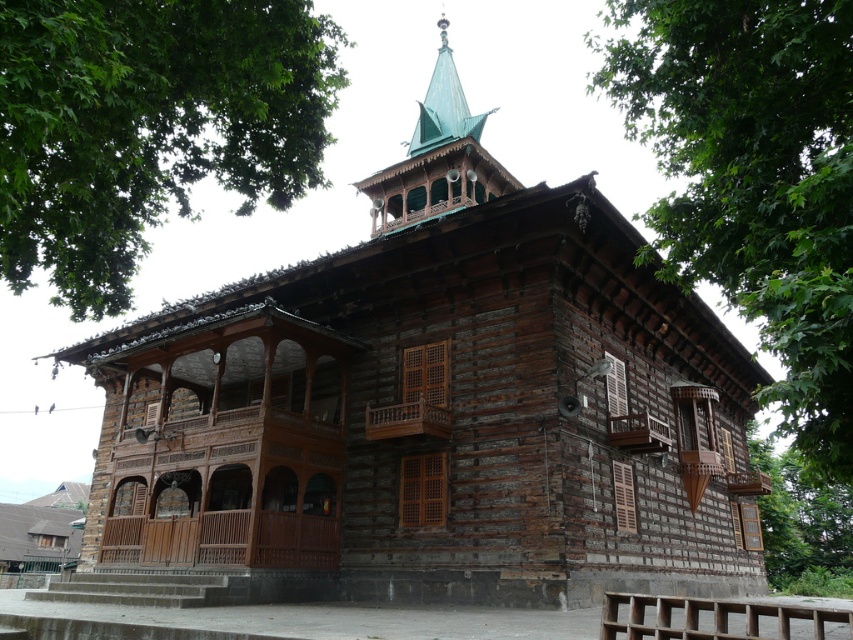
Does green leafy tree at upper left have a smaller size compared to green copper spire at upper center?

Actually, green leafy tree at upper left might be larger than green copper spire at upper center.

Does green leafy tree at upper left appear on the left side of green copper spire at upper center?

Yes, green leafy tree at upper left is to the left of green copper spire at upper center.

The height and width of the screenshot is (640, 853). In order to click on green leafy tree at upper left in this screenshot , I will do `click(148, 125)`.

Image resolution: width=853 pixels, height=640 pixels. What are the coordinates of `green leafy tree at upper left` in the screenshot? It's located at (148, 125).

From the picture: Is green leafy tree at upper left to the right of green leafy tree at upper right from the viewer's perspective?

No, green leafy tree at upper left is not to the right of green leafy tree at upper right.

Is green leafy tree at upper left behind green leafy tree at upper right?

That is False.

This screenshot has height=640, width=853. I want to click on green leafy tree at upper left, so click(x=148, y=125).

At what (x,y) coordinates should I click in order to perform the action: click on green leafy tree at upper left. Please return your answer as a coordinate pair (x, y). The height and width of the screenshot is (640, 853). Looking at the image, I should click on (148, 125).

Describe the element at coordinates (753, 180) in the screenshot. This screenshot has width=853, height=640. I see `green leafy tree at upper right` at that location.

Does point (846, 305) come behind point (466, 170)?

No, it is not.

Which is behind, point (683, 118) or point (498, 182)?

The point (498, 182) is behind.

The width and height of the screenshot is (853, 640). I want to click on green leafy tree at upper right, so click(753, 180).